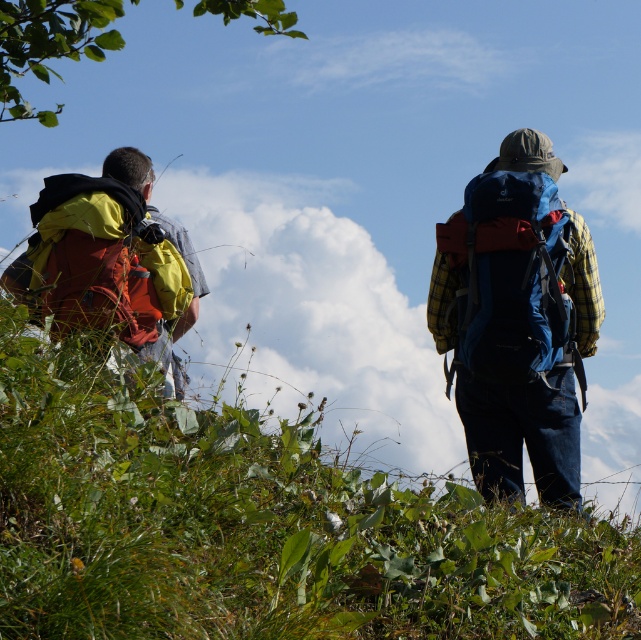
Is blue fabric backpack at right to the right of matte red backpack at left from the viewer's perspective?

Yes, blue fabric backpack at right is to the right of matte red backpack at left.

Locate an element on the screen. This screenshot has width=641, height=640. blue fabric backpack at right is located at coordinates (510, 276).